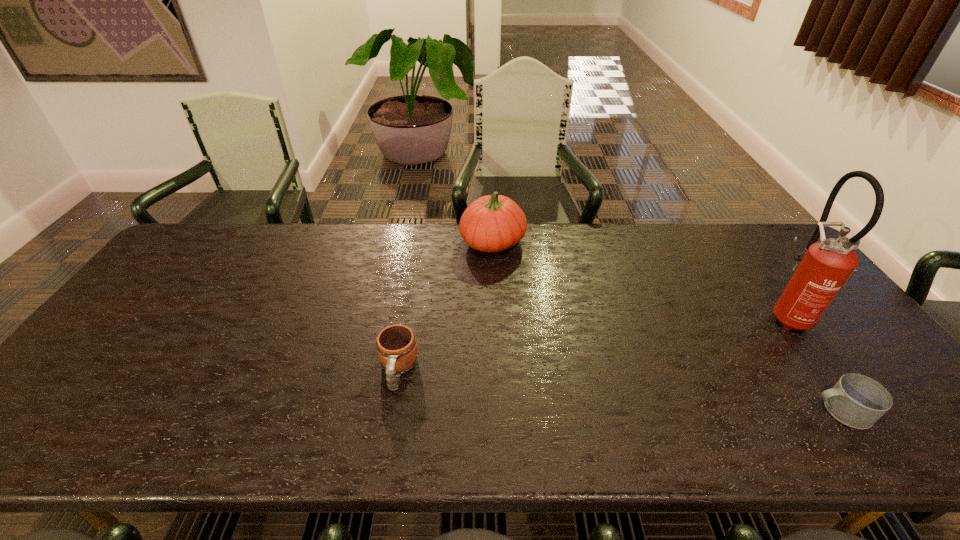
At what (x,y) coordinates should I click in order to perform the action: click on vacant space located at the nozzle of the fire extinguisher. Please return your answer as a coordinate pair (x, y). Looking at the image, I should click on coord(659,316).

Find the location of `vacant space located on the front of the farthest object`. vacant space located on the front of the farthest object is located at coordinates (495, 305).

In order to click on vacant space situated 0.100m on the side of the leftmost object with the handle in this screenshot , I will do `click(387, 437)`.

This screenshot has height=540, width=960. What are the coordinates of `vacant space located 0.360m on the side of the shorter mug with the handle` in the screenshot? It's located at (652, 411).

Identify the location of vacant space located 0.220m on the side of the shorter mug with the handle. This screenshot has height=540, width=960. (714, 411).

At what (x,y) coordinates should I click in order to perform the action: click on vacant area situated 0.370m on the side of the shorter mug with the handle. Please return your answer as a coordinate pair (x, y). This screenshot has width=960, height=540. Looking at the image, I should click on (648, 411).

Find the location of a particular element. The image size is (960, 540). object located in the far edge section of the desktop is located at coordinates (493, 223).

You are a GUI agent. You are given a task and a screenshot of the screen. Output one action in this format:
    pyautogui.click(x=<x>, y=<y>)
    Task: Click on the object located in the near edge section of the desktop
    
    Given the screenshot: What is the action you would take?
    pyautogui.click(x=857, y=401)

I want to click on fire extinguisher that is at the right edge, so click(822, 269).

Where is `mug that is at the right edge`? mug that is at the right edge is located at coordinates (857, 401).